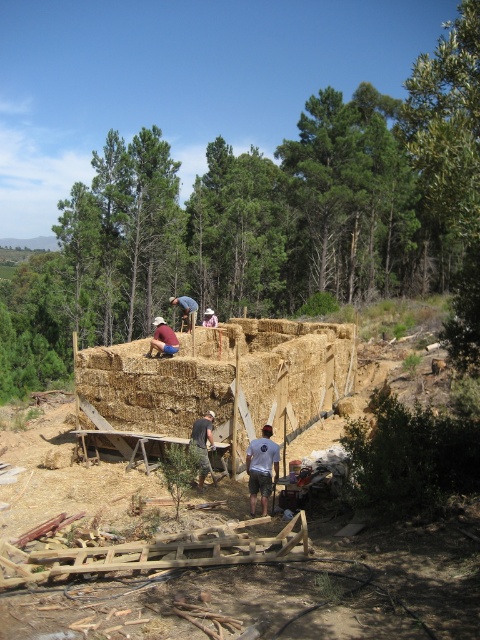
Question: Where is dark gray fabric shirt at center located in relation to blue denim shorts at center in the image?

Choices:
 (A) above
 (B) below

Answer: (B)

Question: Can you confirm if white cotton t-shirt at center is thinner than dark gray fabric shirt at center?

Choices:
 (A) yes
 (B) no

Answer: (B)

Question: Which object is the closest to the white cotton t-shirt at center?

Choices:
 (A) dark gray fabric shirt at center
 (B) matte brown straw bale at center

Answer: (A)

Question: Does white cotton t-shirt at center have a greater width compared to matte brown straw bale at center?

Choices:
 (A) yes
 (B) no

Answer: (B)

Question: Which of the following is the closest to the observer?

Choices:
 (A) matte brown straw bale at center
 (B) blue denim shorts at center
 (C) brown straw hat at upper center

Answer: (A)

Question: Which object appears closest to the camera in this image?

Choices:
 (A) dark gray fabric shirt at center
 (B) brown straw hat at upper center
 (C) matte brown straw bale at center

Answer: (A)